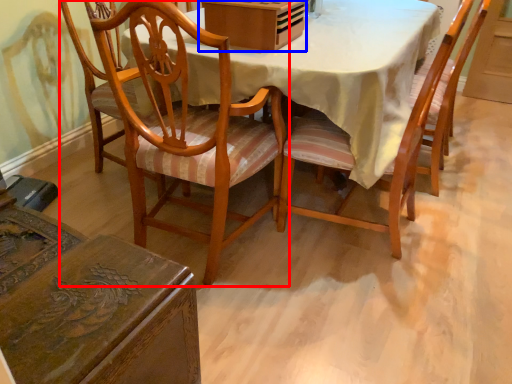
Question: Which point is closer to the camera, chair (highlighted by a red box) or box (highlighted by a blue box)?

Choices:
 (A) chair
 (B) box

Answer: (A)